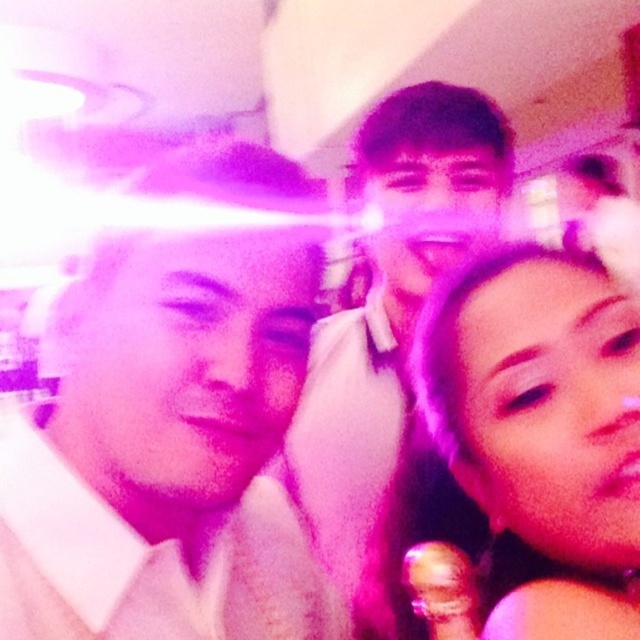
Question: Can you confirm if matte white shirt at left is positioned to the right of matte pink hair at center?

Choices:
 (A) yes
 (B) no

Answer: (B)

Question: Estimate the real-world distances between objects in this image. Which object is farther from the matte pink hair at center?

Choices:
 (A) matte white shirt at left
 (B) matte white shirt at center

Answer: (B)

Question: Does matte pink hair at center appear on the left side of matte white shirt at center?

Choices:
 (A) yes
 (B) no

Answer: (B)

Question: Which of the following is the farthest from the observer?

Choices:
 (A) matte white shirt at left
 (B) matte pink hair at center
 (C) matte white shirt at center

Answer: (C)

Question: Among these points, which one is nearest to the camera?

Choices:
 (A) (109, 252)
 (B) (317, 497)

Answer: (A)

Question: Is matte white shirt at left above matte white shirt at center?

Choices:
 (A) no
 (B) yes

Answer: (A)